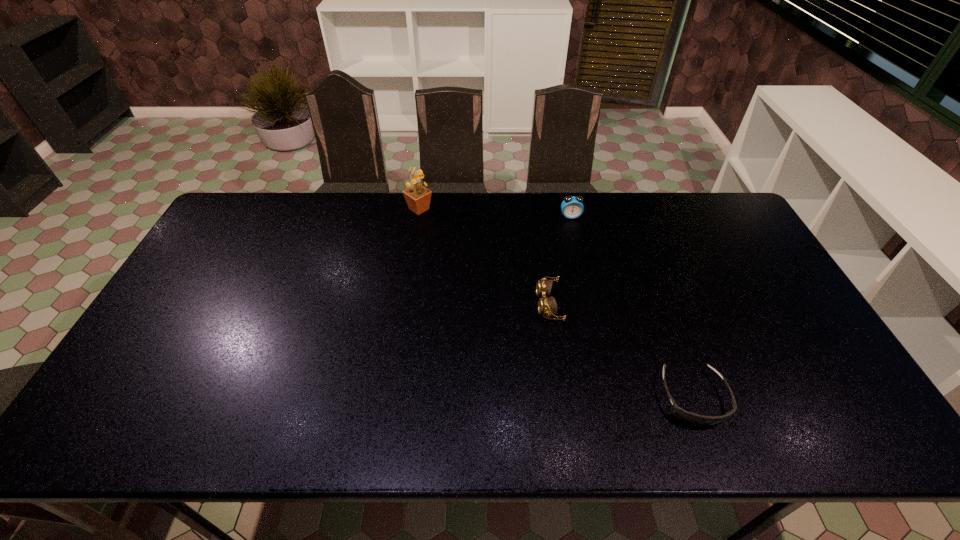
You are a GUI agent. You are given a task and a screenshot of the screen. Output one action in this format:
    pyautogui.click(x=<x>, y=<y>)
    Task: Click on the vacant space located through the lenses of the left goggles
    
    Given the screenshot: What is the action you would take?
    pyautogui.click(x=407, y=305)

This screenshot has height=540, width=960. Identify the location of free space located through the lenses of the left goggles. (484, 305).

Find the location of a particular element. blank space located through the lenses of the left goggles is located at coordinates (456, 305).

The height and width of the screenshot is (540, 960). I want to click on sunflower located at the far edge, so 418,197.

Find the location of a particular element. alarm clock that is positioned at the far edge is located at coordinates (572, 207).

Locate an element on the screen. The height and width of the screenshot is (540, 960). object positioned at the near edge is located at coordinates pyautogui.click(x=695, y=419).

The height and width of the screenshot is (540, 960). What are the coordinates of `vacant space at the far edge of the desktop` in the screenshot? It's located at (282, 204).

Where is `vacant space at the near edge of the desktop`? vacant space at the near edge of the desktop is located at coordinates (303, 430).

The width and height of the screenshot is (960, 540). Identify the location of free space at the left edge. (130, 375).

Locate an element on the screen. This screenshot has width=960, height=540. free space at the right edge of the desktop is located at coordinates (721, 272).